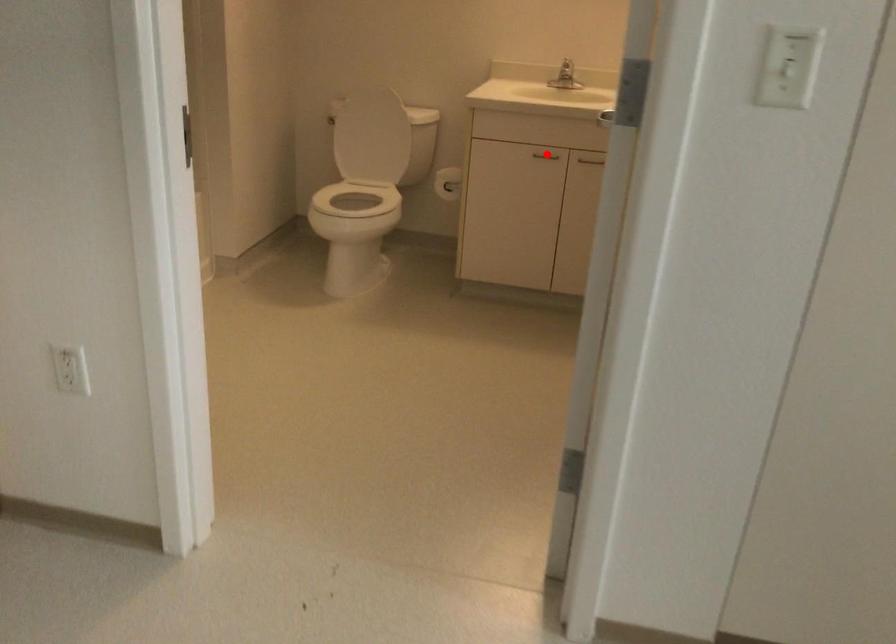
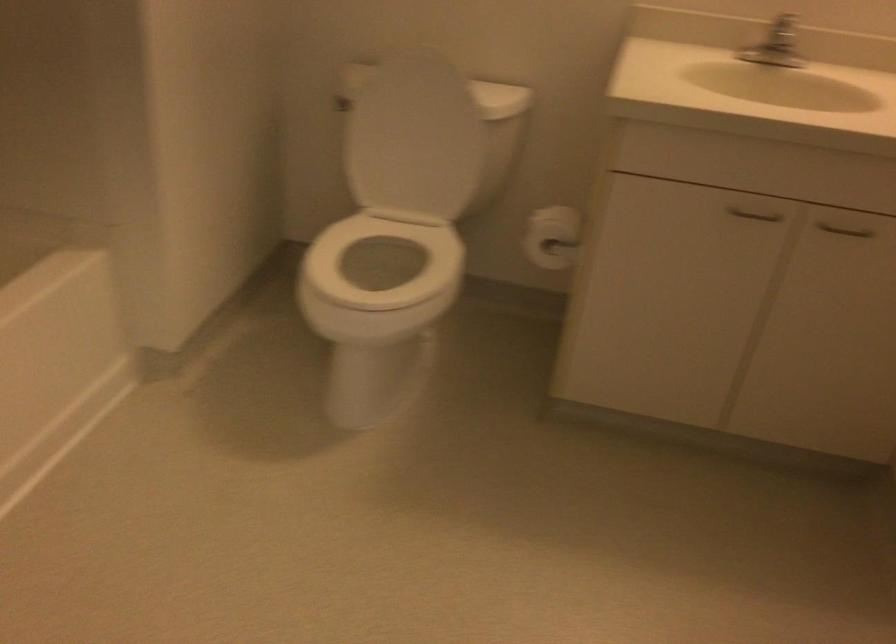
Find the pixel in the second image that matches the highlighted location in the first image.

(754, 214)